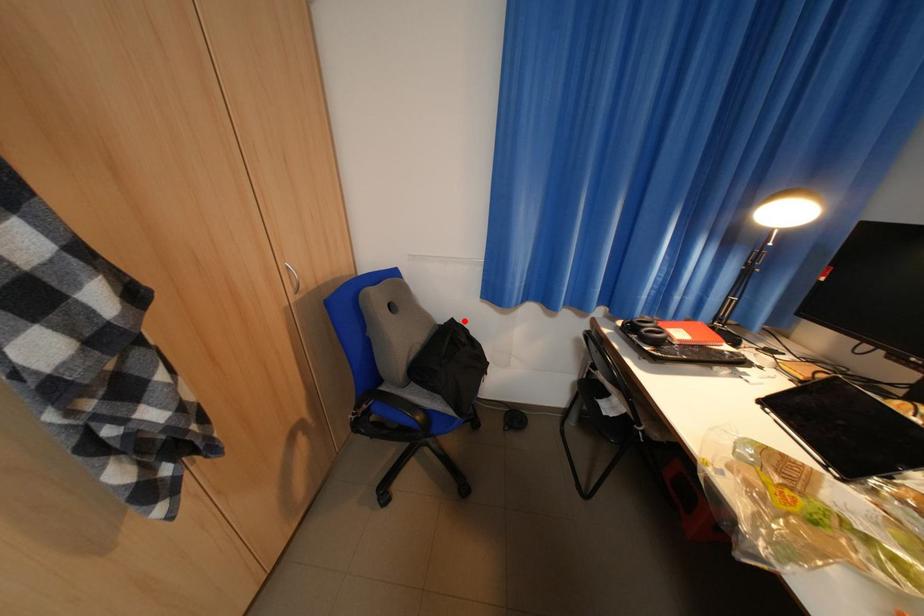
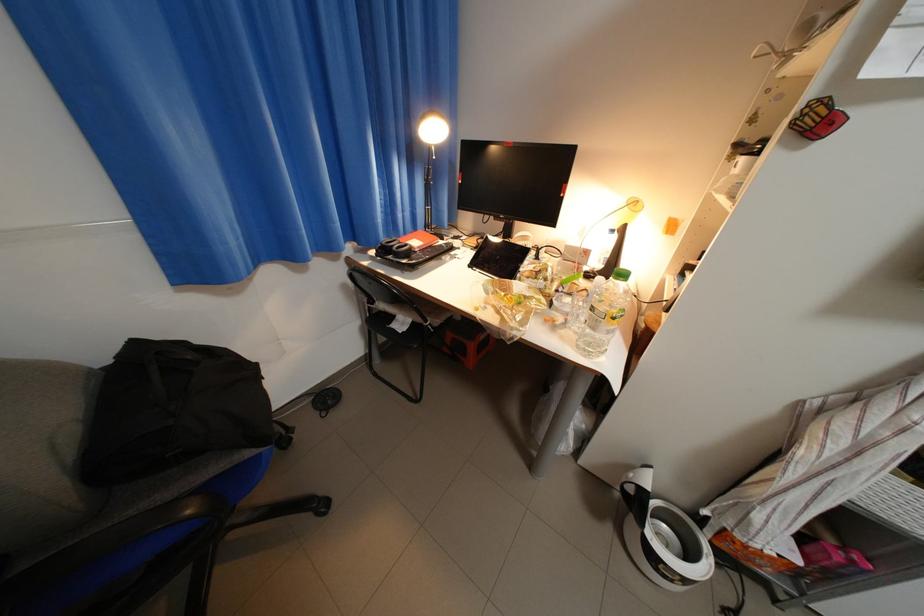
In the second image, find the point that corresponds to the highlighted location in the first image.

(147, 344)